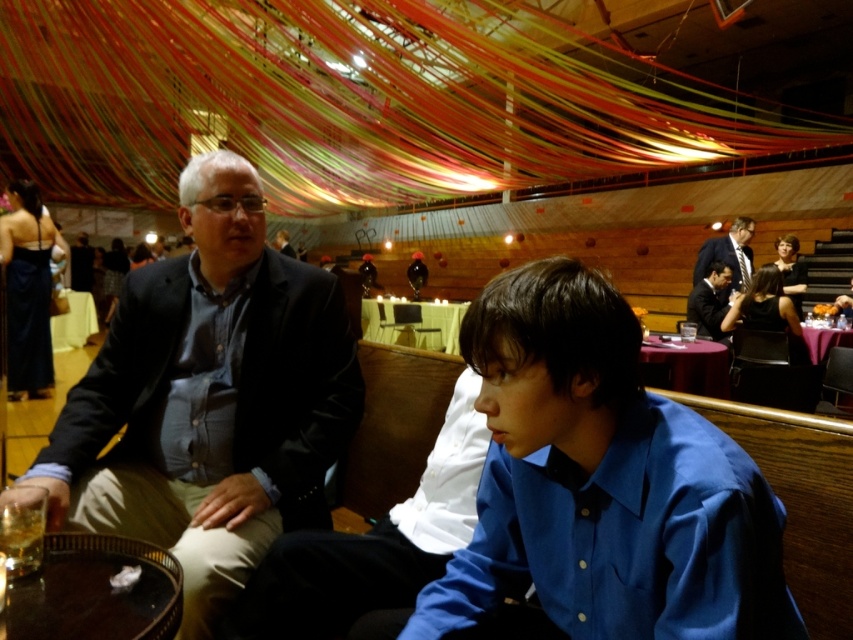
You are a photographer at the event and need to take a photo of the dark blue shirt at center. The camera you are using has a minimum focusing distance of 36 inches. Can you take a clear photo without moving the camera or the subject?

The dark blue shirt at center and camera are 38.46 inches apart, which is beyond the camera minimum focusing distance of 36 inches. Therefore, you can take a clear photo without moving the camera or the subject.